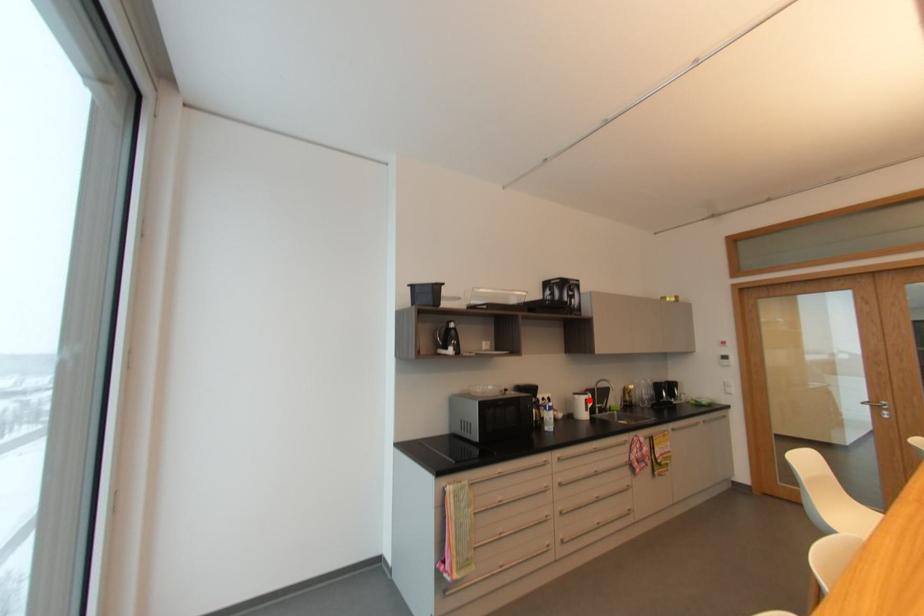
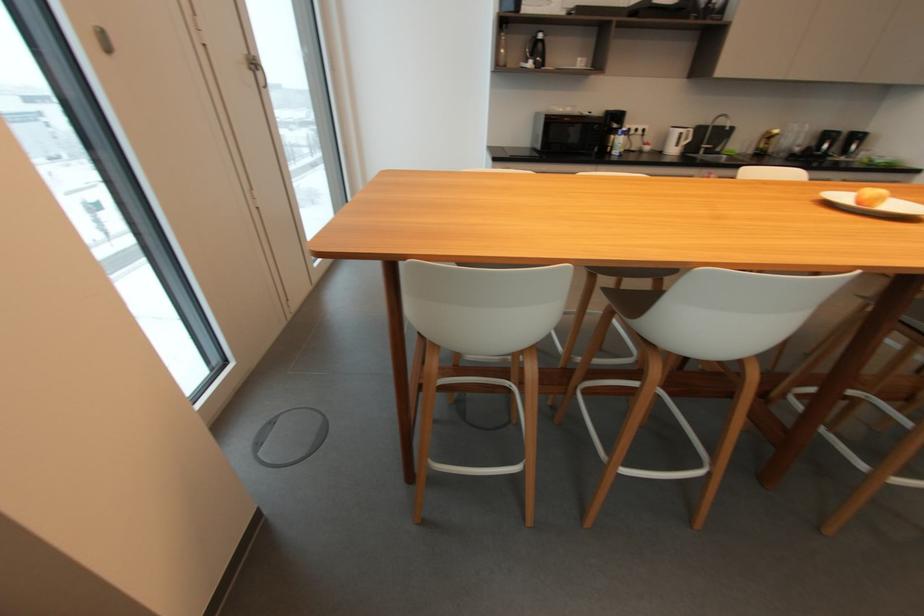
In the second image, find the point that corresponds to the highlighted location in the first image.

(685, 134)